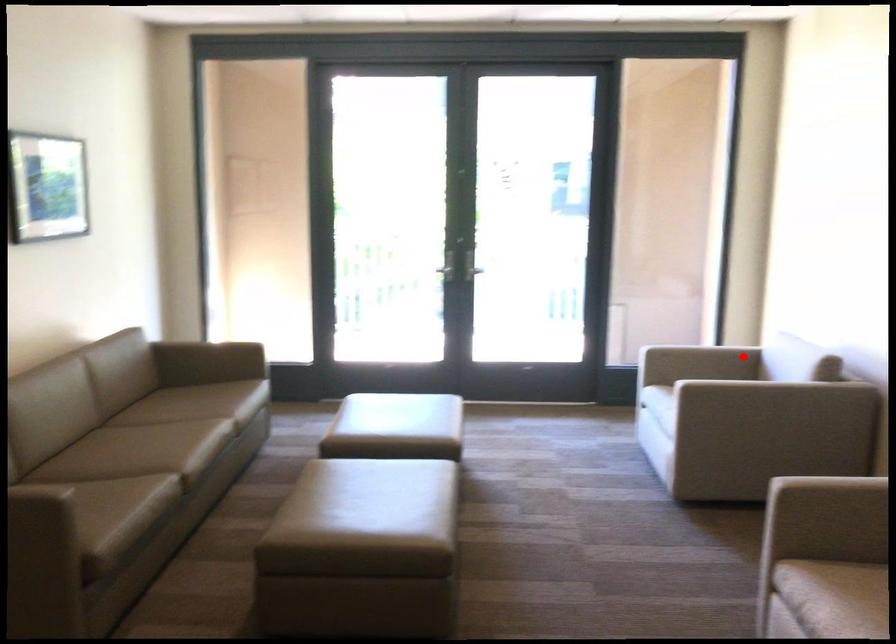
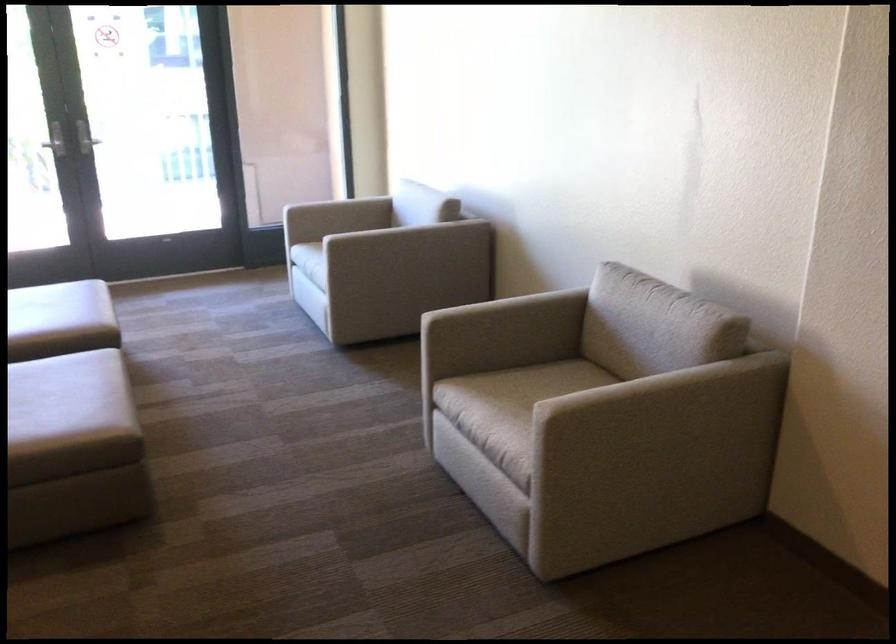
In the second image, find the point that corresponds to the highlighted location in the first image.

(375, 200)